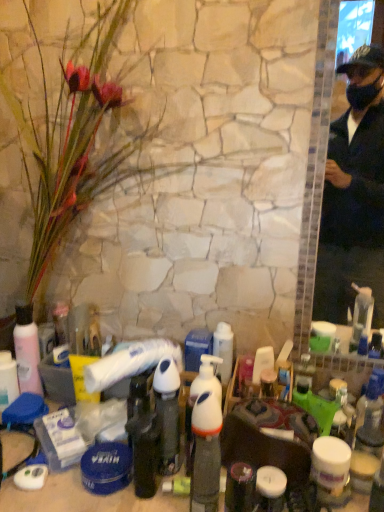
This screenshot has height=512, width=384. What do you see at coordinates (223, 350) in the screenshot? I see `white pump bottle at center` at bounding box center [223, 350].

Where is `pink matte lotion at lower left, acting as the 4th bottle starting from the front`? pink matte lotion at lower left, acting as the 4th bottle starting from the front is located at coordinates (27, 350).

Find the location of a particular element. The height and width of the screenshot is (512, 384). silky pink petals at left is located at coordinates (80, 138).

I want to click on translucent plastic bottle at center, the 2th bottle positioned from the left, so click(x=142, y=436).

In order to click on white plastic pump bottle at center, the third bottle positioned from the back in this screenshot , I will do `click(167, 414)`.

Identify the location of white pump bottle at center. (223, 350).

Considering the relative sizes of pink matte lotion at lower left, acting as the 4th bottle starting from the front, and translucent plastic bottle at center, the 2th bottle positioned from the left, in the image provided, is pink matte lotion at lower left, acting as the 4th bottle starting from the front, bigger than translucent plastic bottle at center, the 2th bottle positioned from the left,?

Correct, pink matte lotion at lower left, acting as the 4th bottle starting from the front, is larger in size than translucent plastic bottle at center, the 2th bottle positioned from the left.

From the image's perspective, would you say pink matte lotion at lower left, placed as the 1th bottle when sorted from left to right, is positioned over translucent plastic bottle at center, which is the 3th bottle from right to left?

Yes, from the image's perspective, pink matte lotion at lower left, placed as the 1th bottle when sorted from left to right, is on top of translucent plastic bottle at center, which is the 3th bottle from right to left.

Which object is closer to the camera, pink matte lotion at lower left, acting as the 4th bottle starting from the front, or translucent plastic bottle at center, which is the 3th bottle from right to left?

translucent plastic bottle at center, which is the 3th bottle from right to left.

Which is behind, point (37, 348) or point (167, 433)?

Point (37, 348)

The image size is (384, 512). Find the location of `the 2nd bottle to the left of the white plastic pump bottle at center, which ranks as the second bottle in front-to-back order, starting your count from the anchor`. the 2nd bottle to the left of the white plastic pump bottle at center, which ranks as the second bottle in front-to-back order, starting your count from the anchor is located at coordinates (27, 350).

In the scene shown: Does pink matte lotion at lower left, placed as the 1th bottle when sorted from back to front, lie behind white plastic pump bottle at center, arranged as the 2th bottle when viewed from the right?

Yes, it is behind white plastic pump bottle at center, arranged as the 2th bottle when viewed from the right.

Based on the photo, from the image's perspective, is pink matte lotion at lower left, acting as the 4th bottle starting from the front, on white plastic pump bottle at center, the third bottle positioned from the back?

Correct, pink matte lotion at lower left, acting as the 4th bottle starting from the front, appears higher than white plastic pump bottle at center, the third bottle positioned from the back, in the image.

Locate an element on the screen. toiletry that appears on the right of silky pink petals at left is located at coordinates (223, 350).

Could you tell me if white pump bottle at center is turned towards silky pink petals at left?

No.

From the image's perspective, is white pump bottle at center below silky pink petals at left?

Yes, from the image's perspective, white pump bottle at center is below silky pink petals at left.

From a real-world perspective, who is located lower, translucent plastic bottle at center, which is counted as the second bottle, starting from the back, or white pump bottle at center?

translucent plastic bottle at center, which is counted as the second bottle, starting from the back.

In terms of size, does translucent plastic bottle at center, which is counted as the second bottle, starting from the back, appear bigger or smaller than white pump bottle at center?

In the image, translucent plastic bottle at center, which is counted as the second bottle, starting from the back, appears to be smaller than white pump bottle at center.

From the image's perspective, which object appears higher, translucent plastic bottle at center, which is counted as the second bottle, starting from the back, or white pump bottle at center?

white pump bottle at center appears higher in the image.

Is point (138, 402) closer or farther from the camera than point (230, 327)?

Point (138, 402) is closer to the camera than point (230, 327).

Who is more distant, pink matte lotion at lower left, placed as the 1th bottle when sorted from left to right, or white glossy pump bottle at center, which is the fourth bottle in back-to-front order?

pink matte lotion at lower left, placed as the 1th bottle when sorted from left to right, is behind.

Considering the relative sizes of pink matte lotion at lower left, placed as the 1th bottle when sorted from back to front, and white glossy pump bottle at center, which is the fourth bottle in back-to-front order, in the image provided, is pink matte lotion at lower left, placed as the 1th bottle when sorted from back to front, shorter than white glossy pump bottle at center, which is the fourth bottle in back-to-front order,?

In fact, pink matte lotion at lower left, placed as the 1th bottle when sorted from back to front, may be taller than white glossy pump bottle at center, which is the fourth bottle in back-to-front order.

Based on the photo, is pink matte lotion at lower left, placed as the 1th bottle when sorted from left to right, far from white glossy pump bottle at center, the fourth bottle in the left-to-right sequence?

No, pink matte lotion at lower left, placed as the 1th bottle when sorted from left to right, is not far from white glossy pump bottle at center, the fourth bottle in the left-to-right sequence.

Considering the relative positions of pink matte lotion at lower left, placed as the 1th bottle when sorted from back to front, and white glossy pump bottle at center, the 1th bottle when ordered from right to left, in the image provided, is pink matte lotion at lower left, placed as the 1th bottle when sorted from back to front, to the left or to the right of white glossy pump bottle at center, the 1th bottle when ordered from right to left,?

Clearly, pink matte lotion at lower left, placed as the 1th bottle when sorted from back to front, is on the left of white glossy pump bottle at center, the 1th bottle when ordered from right to left, in the image.

From the image's perspective, which one is positioned lower, translucent plastic bottle at center, which is the 3th bottle from right to left, or white glossy pump bottle at center, the fourth bottle in the left-to-right sequence?

white glossy pump bottle at center, the fourth bottle in the left-to-right sequence, is shown below in the image.

From a real-world perspective, is translucent plastic bottle at center, the 3th bottle when ordered from front to back, located higher than white glossy pump bottle at center, the 1th bottle when ordered from right to left?

Incorrect, from a real-world perspective, translucent plastic bottle at center, the 3th bottle when ordered from front to back, is lower than white glossy pump bottle at center, the 1th bottle when ordered from right to left.

Based on the photo, is translucent plastic bottle at center, the 3th bottle when ordered from front to back, shorter than white glossy pump bottle at center, which is the fourth bottle in back-to-front order?

Correct, translucent plastic bottle at center, the 3th bottle when ordered from front to back, is not as tall as white glossy pump bottle at center, which is the fourth bottle in back-to-front order.

Is translucent plastic bottle at center, which is the 3th bottle from right to left, placed right next to white glossy pump bottle at center, the fourth bottle in the left-to-right sequence?

No, translucent plastic bottle at center, which is the 3th bottle from right to left, is not next to white glossy pump bottle at center, the fourth bottle in the left-to-right sequence.

In terms of size, does pink matte lotion at lower left, placed as the 1th bottle when sorted from back to front, appear bigger or smaller than white pump bottle at center?

Clearly, pink matte lotion at lower left, placed as the 1th bottle when sorted from back to front, is larger in size than white pump bottle at center.

Considering the sizes of objects pink matte lotion at lower left, which is the fourth bottle in right-to-left order, and white pump bottle at center in the image provided, who is wider, pink matte lotion at lower left, which is the fourth bottle in right-to-left order, or white pump bottle at center?

Wider between the two is white pump bottle at center.

Is pink matte lotion at lower left, placed as the 1th bottle when sorted from back to front, shorter than white pump bottle at center?

No, pink matte lotion at lower left, placed as the 1th bottle when sorted from back to front, is not shorter than white pump bottle at center.

Identify the location of bottle that is the 1st one when counting rightward from the pink matte lotion at lower left, placed as the 1th bottle when sorted from left to right. This screenshot has width=384, height=512. (142, 436).

Starting from the white plastic pump bottle at center, which is counted as the third bottle, starting from the left, which bottle is the 2nd one behind? Please provide its 2D coordinates.

[(27, 350)]

Based on their spatial positions, is white plastic pump bottle at center, which is counted as the third bottle, starting from the left, or translucent plastic bottle at center, which is counted as the second bottle, starting from the back, closer to pink matte lotion at lower left, placed as the 1th bottle when sorted from back to front?

translucent plastic bottle at center, which is counted as the second bottle, starting from the back, lies closer to pink matte lotion at lower left, placed as the 1th bottle when sorted from back to front, than the other object.

Which object lies nearer to the anchor point pink matte lotion at lower left, placed as the 1th bottle when sorted from back to front, white glossy pump bottle at center, which is the fourth bottle in back-to-front order, or silky pink petals at left?

silky pink petals at left is closer to pink matte lotion at lower left, placed as the 1th bottle when sorted from back to front.

Which object lies nearer to the anchor point silky pink petals at left, translucent plastic bottle at center, the 2th bottle positioned from the left, or white glossy pump bottle at center, the 1th bottle when ordered from right to left?

translucent plastic bottle at center, the 2th bottle positioned from the left, lies closer to silky pink petals at left than the other object.

Based on their spatial positions, is white plastic pump bottle at center, which is counted as the third bottle, starting from the left, or translucent plastic bottle at center, the 3th bottle when ordered from front to back, further from white glossy pump bottle at center, which is the fourth bottle in back-to-front order?

Among the two, translucent plastic bottle at center, the 3th bottle when ordered from front to back, is located further to white glossy pump bottle at center, which is the fourth bottle in back-to-front order.

When comparing their distances from white pump bottle at center, does silky pink petals at left or pink matte lotion at lower left, which is the fourth bottle in right-to-left order, seem closer?

Among the two, pink matte lotion at lower left, which is the fourth bottle in right-to-left order, is located nearer to white pump bottle at center.

When comparing their distances from white glossy pump bottle at center, which is the fourth bottle in back-to-front order, does translucent plastic bottle at center, the 2th bottle positioned from the left, or pink matte lotion at lower left, placed as the 1th bottle when sorted from back to front, seem closer?

Based on the image, translucent plastic bottle at center, the 2th bottle positioned from the left, appears to be nearer to white glossy pump bottle at center, which is the fourth bottle in back-to-front order.

From the picture: Looking at the image, which one is located further to translucent plastic bottle at center, the 2th bottle positioned from the left, pink matte lotion at lower left, placed as the 1th bottle when sorted from left to right, or white glossy pump bottle at center, the first bottle from the front?

Based on the image, pink matte lotion at lower left, placed as the 1th bottle when sorted from left to right, appears to be further to translucent plastic bottle at center, the 2th bottle positioned from the left.

Based on their spatial positions, is translucent plastic bottle at center, which is counted as the second bottle, starting from the back, or white plastic pump bottle at center, which ranks as the second bottle in front-to-back order, closer to white glossy pump bottle at center, the first bottle from the front?

The object closer to white glossy pump bottle at center, the first bottle from the front, is white plastic pump bottle at center, which ranks as the second bottle in front-to-back order.

Image resolution: width=384 pixels, height=512 pixels. What are the coordinates of `bottle between white glossy pump bottle at center, the fourth bottle in the left-to-right sequence, and translucent plastic bottle at center, the 2th bottle positioned from the left, in the front-back direction` in the screenshot? It's located at (167, 414).

The height and width of the screenshot is (512, 384). I want to click on toiletry positioned between silky pink petals at left and pink matte lotion at lower left, acting as the 4th bottle starting from the front, from near to far, so click(x=223, y=350).

The image size is (384, 512). What are the coordinates of `bottle positioned between silky pink petals at left and white plastic pump bottle at center, arranged as the 2th bottle when viewed from the right, from near to far` in the screenshot? It's located at (206, 438).

You are a GUI agent. You are given a task and a screenshot of the screen. Output one action in this format:
    pyautogui.click(x=<x>, y=<y>)
    Task: Click on the bottle between pink matte lotion at lower left, placed as the 1th bottle when sorted from left to right, and white plastic pump bottle at center, arranged as the 2th bottle when viewed from the right
    Image resolution: width=384 pixels, height=512 pixels.
    Given the screenshot: What is the action you would take?
    pyautogui.click(x=142, y=436)